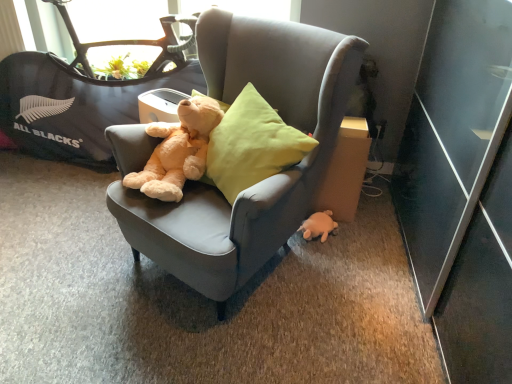
Question: Looking at the image, does white plush turtle at lower right seem bigger or smaller compared to velvet gray chair at center?

Choices:
 (A) small
 (B) big

Answer: (A)

Question: Relative to velvet gray chair at center, is white plush turtle at lower right in front or behind?

Choices:
 (A) behind
 (B) front

Answer: (A)

Question: Which object is positioned closest to the white plush turtle at lower right?

Choices:
 (A) velvet gray chair at center
 (B) light brown plush teddy bear at center
 (C) cardboard at right
 (D) black fabric baby carriage at upper left

Answer: (C)

Question: Estimate the real-world distances between objects in this image. Which object is farther from the velvet gray chair at center?

Choices:
 (A) light brown plush teddy bear at center
 (B) cardboard at right
 (C) black fabric baby carriage at upper left
 (D) white plush turtle at lower right

Answer: (C)